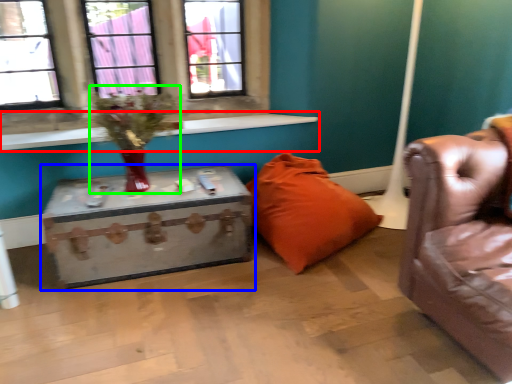
Question: Estimate the real-world distances between objects in this image. Which object is closer to window sill (highlighted by a red box), table (highlighted by a blue box) or floral arrangement (highlighted by a green box)?

Choices:
 (A) table
 (B) floral arrangement

Answer: (B)